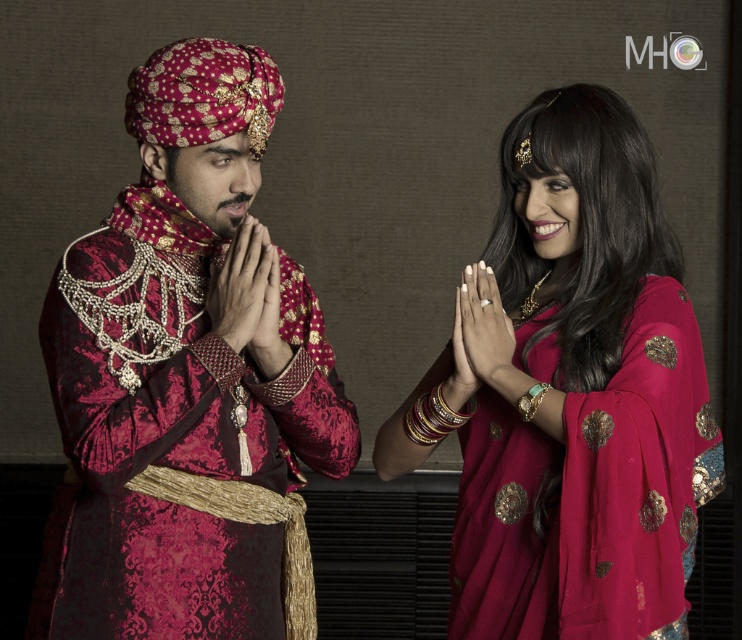
You are an event planner arranging a photo shoot for a cultural exhibition. You need to position two models wearing the velvet maroon robe at left and the matte red sari at center. Given their attire, which model should stand closer to the camera to ensure both appear proportionate in the final image?

The matte red sari at center should stand closer to the camera because the velvet maroon robe at left has a greater height. This adjustment will help balance their sizes in the photo.

Based on the photo, based on the scene description, can you identify the object located at the coordinate point (187, 378)?

The object at point (187, 378) is the velvet maroon robe at left.

You are designing a stage backdrop for a cultural performance where the velvet maroon robe at left and the matte gold hand at center must be highlighted. Given their sizes, which object should be placed closer to the front to ensure both are clearly visible to the audience?

The matte gold hand at center should be placed closer to the front since the velvet maroon robe at left is wider, allowing both objects to be clearly visible without one overshadowing the other.